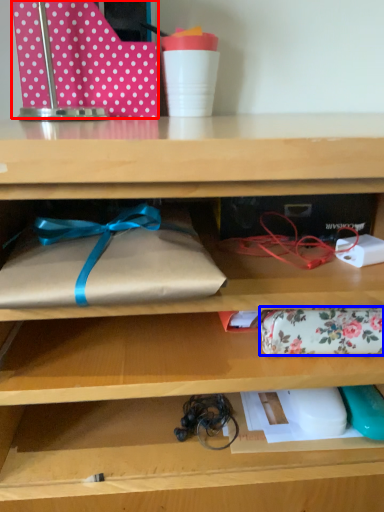
Question: Which object is closer to the camera taking this photo, wrapping paper (highlighted by a red box) or wrap (highlighted by a blue box)?

Choices:
 (A) wrapping paper
 (B) wrap

Answer: (B)